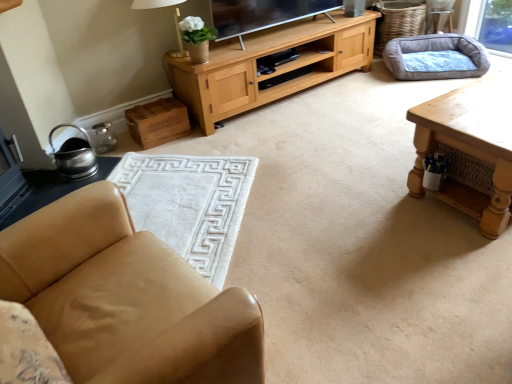
Where is `vacant area that lies between tan leather chair at lower left and gray fabric dog bed at upper right`? The height and width of the screenshot is (384, 512). vacant area that lies between tan leather chair at lower left and gray fabric dog bed at upper right is located at coordinates click(x=339, y=175).